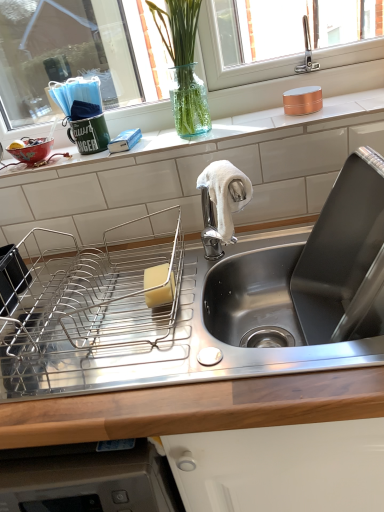
Find the location of a particular element. Image resolution: width=384 pixels, height=512 pixels. vacant space situated on the left part of copper metallic canister at upper right, positioned as the 1th appliance in right-to-left order is located at coordinates (249, 123).